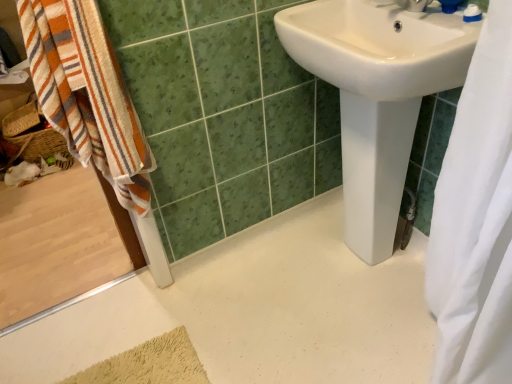
Question: Should I look upward or downward to see striped cotton towel at left?

Choices:
 (A) up
 (B) down

Answer: (A)

Question: Considering the relative positions of white fabric shower curtain at right and white glossy faucet at upper right in the image provided, is white fabric shower curtain at right to the left of white glossy faucet at upper right from the viewer's perspective?

Choices:
 (A) yes
 (B) no

Answer: (B)

Question: Is white fabric shower curtain at right surrounding white glossy faucet at upper right?

Choices:
 (A) yes
 (B) no

Answer: (B)

Question: Is white fabric shower curtain at right shorter than white glossy faucet at upper right?

Choices:
 (A) yes
 (B) no

Answer: (B)

Question: Is white fabric shower curtain at right taller than white glossy faucet at upper right?

Choices:
 (A) yes
 (B) no

Answer: (A)

Question: Considering the relative sizes of white fabric shower curtain at right and white glossy faucet at upper right in the image provided, is white fabric shower curtain at right smaller than white glossy faucet at upper right?

Choices:
 (A) no
 (B) yes

Answer: (A)

Question: From the image's perspective, is white fabric shower curtain at right over white glossy faucet at upper right?

Choices:
 (A) yes
 (B) no

Answer: (B)

Question: From a real-world perspective, is white plastic toothpaste tube at upper right positioned under white glossy sink at center based on gravity?

Choices:
 (A) yes
 (B) no

Answer: (B)

Question: From the image's perspective, is white plastic toothpaste tube at upper right on top of white glossy sink at center?

Choices:
 (A) no
 (B) yes

Answer: (B)

Question: Can you confirm if white plastic toothpaste tube at upper right is thinner than white glossy sink at center?

Choices:
 (A) yes
 (B) no

Answer: (A)

Question: Considering the relative positions of white plastic toothpaste tube at upper right and white glossy sink at center in the image provided, is white plastic toothpaste tube at upper right to the left of white glossy sink at center from the viewer's perspective?

Choices:
 (A) no
 (B) yes

Answer: (A)

Question: Considering the relative sizes of white plastic toothpaste tube at upper right and white glossy sink at center in the image provided, is white plastic toothpaste tube at upper right smaller than white glossy sink at center?

Choices:
 (A) yes
 (B) no

Answer: (A)

Question: Is there a large distance between white plastic toothpaste tube at upper right and white glossy sink at center?

Choices:
 (A) no
 (B) yes

Answer: (A)

Question: Considering the relative sizes of white glossy sink at center and white plastic toothpaste tube at upper right in the image provided, is white glossy sink at center shorter than white plastic toothpaste tube at upper right?

Choices:
 (A) yes
 (B) no

Answer: (B)